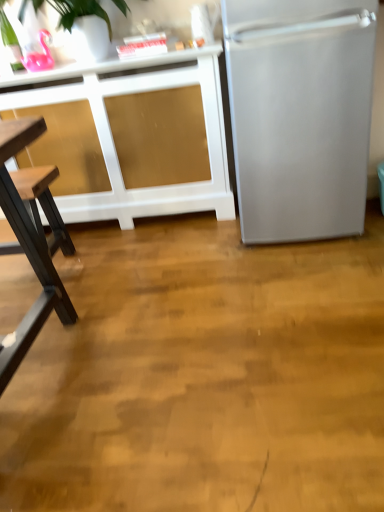
Identify the location of satin silver refrigerator at right. (300, 114).

What do you see at coordinates (300, 114) in the screenshot? The width and height of the screenshot is (384, 512). I see `satin silver refrigerator at right` at bounding box center [300, 114].

The width and height of the screenshot is (384, 512). Describe the element at coordinates (113, 138) in the screenshot. I see `white matte cabinet at upper left` at that location.

Where is `white matte cabinet at upper left`? Image resolution: width=384 pixels, height=512 pixels. white matte cabinet at upper left is located at coordinates (113, 138).

Identify the location of satin silver refrigerator at right. (300, 114).

Considering the positions of objects white matte cabinet at upper left and satin silver refrigerator at right in the image provided, who is more to the left, white matte cabinet at upper left or satin silver refrigerator at right?

Positioned to the left is white matte cabinet at upper left.

Is white matte cabinet at upper left positioned behind satin silver refrigerator at right?

Yes, white matte cabinet at upper left is behind satin silver refrigerator at right.

Does point (164, 212) appear closer or farther from the camera than point (264, 105)?

Point (164, 212).

Looking at this image, from the image's perspective, would you say white matte cabinet at upper left is shown under satin silver refrigerator at right?

Yes, from the image's perspective, white matte cabinet at upper left is beneath satin silver refrigerator at right.

From a real-world perspective, is white matte cabinet at upper left beneath satin silver refrigerator at right?

Yes, from a real-world perspective, white matte cabinet at upper left is beneath satin silver refrigerator at right.

Does white matte cabinet at upper left have a lesser width compared to satin silver refrigerator at right?

Answer: Indeed, white matte cabinet at upper left has a lesser width compared to satin silver refrigerator at right.

Is white matte cabinet at upper left shorter than satin silver refrigerator at right?

Indeed, white matte cabinet at upper left has a lesser height compared to satin silver refrigerator at right.

Which of these two, white matte cabinet at upper left or satin silver refrigerator at right, is smaller?

white matte cabinet at upper left is smaller.

Which is correct: white matte cabinet at upper left is inside satin silver refrigerator at right, or outside of it?

white matte cabinet at upper left is spatially situated outside satin silver refrigerator at right.

Is white matte cabinet at upper left far away from satin silver refrigerator at right?

No, white matte cabinet at upper left is not far away from satin silver refrigerator at right.

Is white matte cabinet at upper left positioned with its back to satin silver refrigerator at right?

No, white matte cabinet at upper left's orientation is not away from satin silver refrigerator at right.

Consider the image. How distant is white matte cabinet at upper left from satin silver refrigerator at right?

white matte cabinet at upper left is 56.53 centimeters away from satin silver refrigerator at right.

Where is `cabinetry below the satin silver refrigerator at right (from a real-world perspective)`? The image size is (384, 512). cabinetry below the satin silver refrigerator at right (from a real-world perspective) is located at coordinates (113, 138).

Looking at this image, considering the positions of objects satin silver refrigerator at right and white matte cabinet at upper left in the image provided, who is more to the left, satin silver refrigerator at right or white matte cabinet at upper left?

From the viewer's perspective, white matte cabinet at upper left appears more on the left side.

Relative to white matte cabinet at upper left, is satin silver refrigerator at right in front or behind?

Visually, satin silver refrigerator at right is located in front of white matte cabinet at upper left.

Considering the points (256, 187) and (135, 71), which point is in front, point (256, 187) or point (135, 71)?

Positioned in front is point (256, 187).

From the image's perspective, would you say satin silver refrigerator at right is positioned over white matte cabinet at upper left?

Yes, from the image's perspective, satin silver refrigerator at right is on top of white matte cabinet at upper left.

From a real-world perspective, does satin silver refrigerator at right sit lower than white matte cabinet at upper left?

No, from a real-world perspective, satin silver refrigerator at right is not below white matte cabinet at upper left.

Which of these two, satin silver refrigerator at right or white matte cabinet at upper left, is wider?

satin silver refrigerator at right is wider.

Considering the relative sizes of satin silver refrigerator at right and white matte cabinet at upper left in the image provided, is satin silver refrigerator at right taller than white matte cabinet at upper left?

Indeed, satin silver refrigerator at right has a greater height compared to white matte cabinet at upper left.

Does satin silver refrigerator at right have a larger size compared to white matte cabinet at upper left?

Indeed, satin silver refrigerator at right has a larger size compared to white matte cabinet at upper left.

Is satin silver refrigerator at right located outside white matte cabinet at upper left?

Yes, satin silver refrigerator at right is not within white matte cabinet at upper left.

Is satin silver refrigerator at right with white matte cabinet at upper left?

satin silver refrigerator at right is not next to white matte cabinet at upper left, and they're not touching.

Is satin silver refrigerator at right facing towards white matte cabinet at upper left?

No.

Can you tell me how much satin silver refrigerator at right and white matte cabinet at upper left differ in facing direction?

There is a 2.04e-05-degree angle between the facing directions of satin silver refrigerator at right and white matte cabinet at upper left.

Where is `cabinetry below the satin silver refrigerator at right (from the image's perspective)`? cabinetry below the satin silver refrigerator at right (from the image's perspective) is located at coordinates (113, 138).

You are a GUI agent. You are given a task and a screenshot of the screen. Output one action in this format:
    pyautogui.click(x=<x>, y=<y>)
    Task: Click on the cabinetry on the left of satin silver refrigerator at right
    This screenshot has width=384, height=512.
    Given the screenshot: What is the action you would take?
    pyautogui.click(x=113, y=138)

Image resolution: width=384 pixels, height=512 pixels. What are the coordinates of `refrigerator that appears above the white matte cabinet at upper left (from the image's perspective)` in the screenshot? It's located at (300, 114).